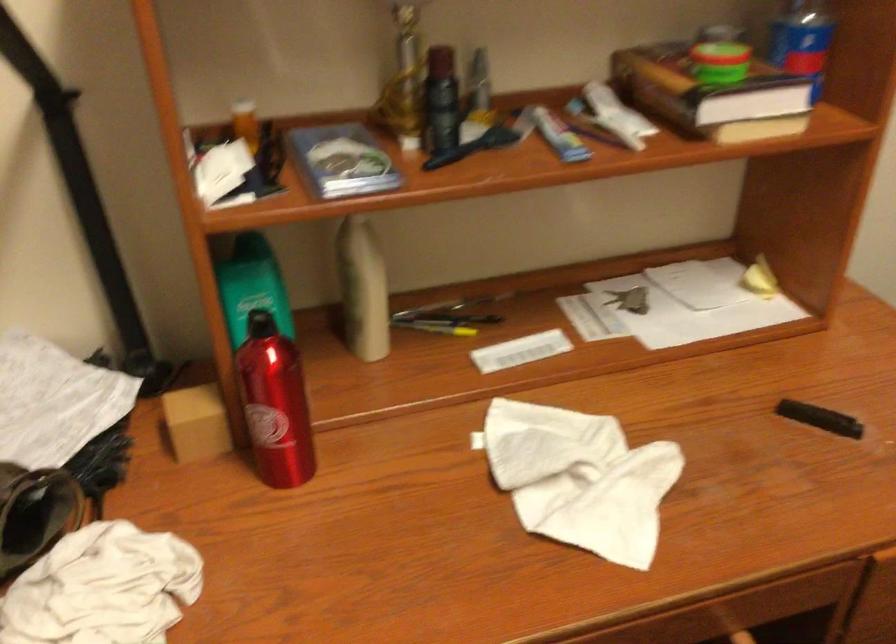
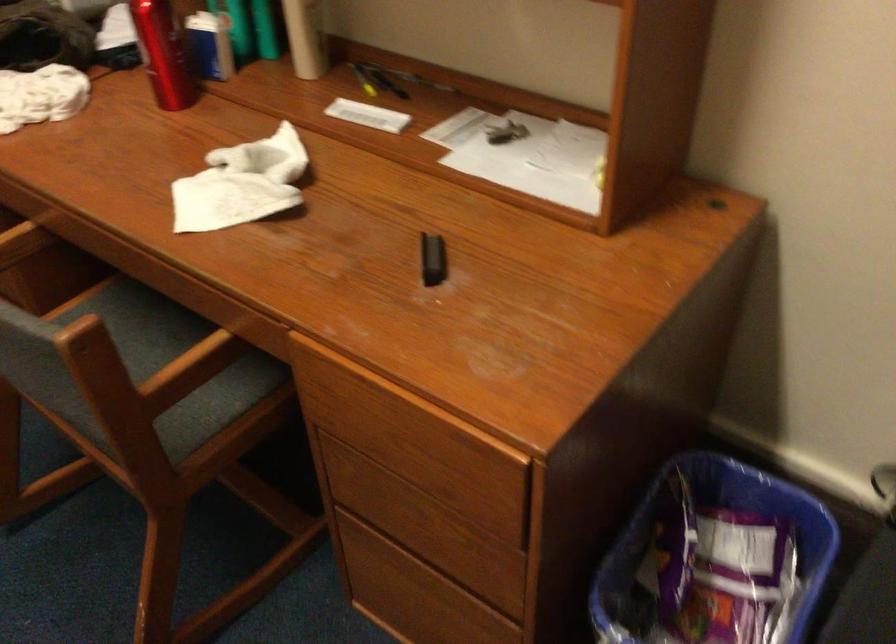
Locate, in the second image, the point that corresponds to (428,327) in the first image.

(363, 80)